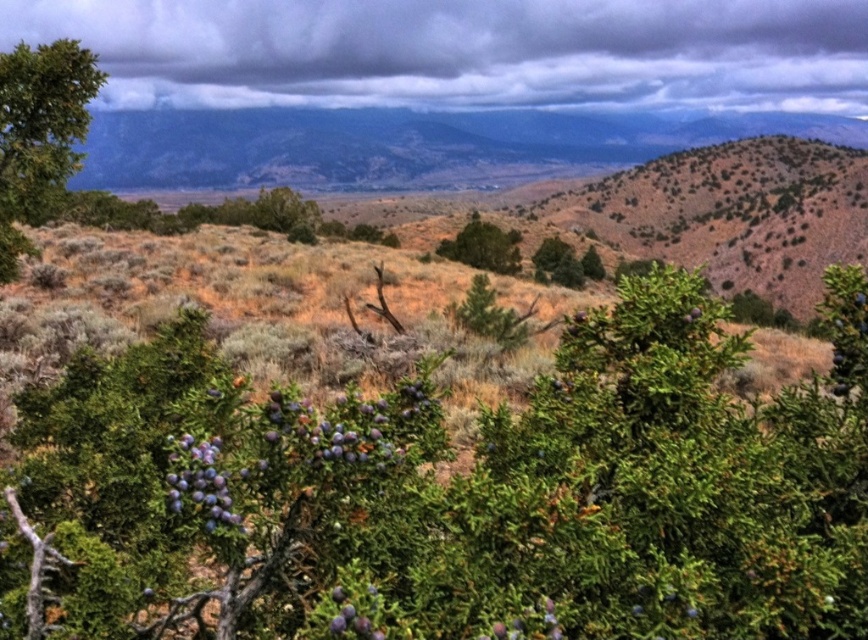
Who is positioned more to the right, cloudy sky at upper center or green textured bush at center?

Positioned to the right is green textured bush at center.

Does point (483, 19) come behind point (464, 248)?

Yes, it is behind point (464, 248).

This screenshot has height=640, width=868. Identify the location of cloudy sky at upper center. (465, 51).

Is green textured bush at center to the right of purple matte berries at center from the viewer's perspective?

Correct, you'll find green textured bush at center to the right of purple matte berries at center.

Can you confirm if green textured bush at center is taller than purple matte berries at center?

Yes.

Between point (502, 243) and point (358, 618), which one is positioned in front?

Point (358, 618) is in front.

Where is `green textured bush at center`? The image size is (868, 640). green textured bush at center is located at coordinates (483, 246).

Who is positioned more to the left, blueberry-like at right or green textured bush at center?

From the viewer's perspective, blueberry-like at right appears more on the left side.

Is blueberry-like at right below green textured bush at center?

Yes, blueberry-like at right is below green textured bush at center.

At what (x,y) coordinates should I click in order to perform the action: click on blueberry-like at right. Please return your answer as a coordinate pair (x, y). This screenshot has height=640, width=868. Looking at the image, I should click on (847, 339).